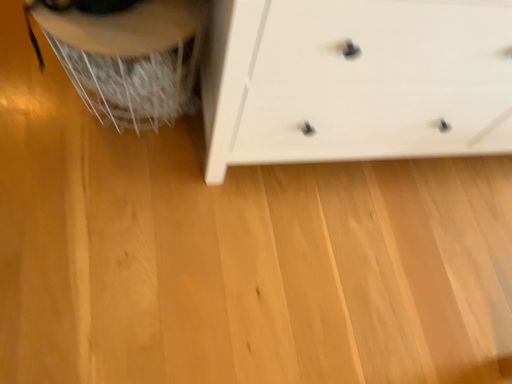
The width and height of the screenshot is (512, 384). Find the location of `vacant area that lies in front of white plastic swivel chair at left`. vacant area that lies in front of white plastic swivel chair at left is located at coordinates point(88,194).